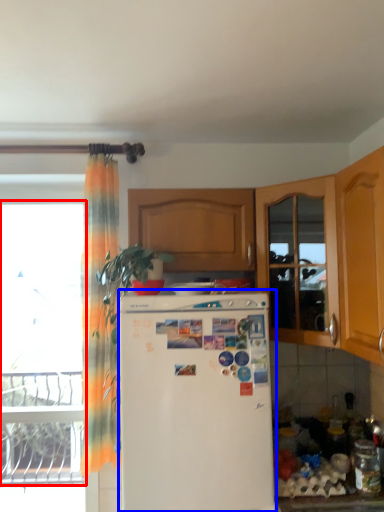
Question: Which point is closer to the camera, window (highlighted by a red box) or refrigerator (highlighted by a blue box)?

Choices:
 (A) window
 (B) refrigerator

Answer: (B)